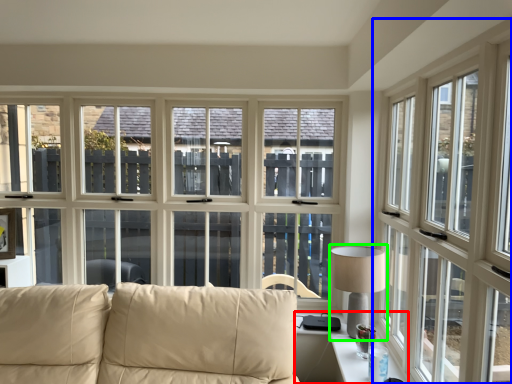
Question: Estimate the real-world distances between objects in this image. Which object is farther from table (highlighted by a red box), window (highlighted by a blue box) or table lamp (highlighted by a green box)?

Choices:
 (A) window
 (B) table lamp

Answer: (A)